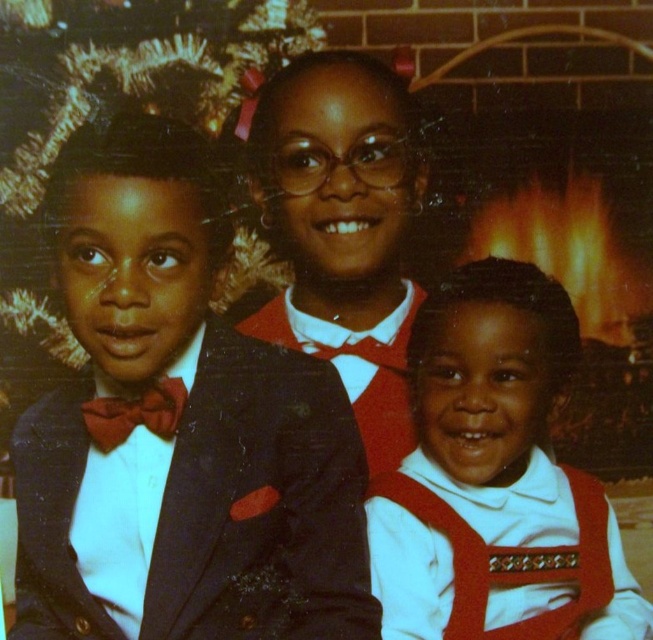
You are a photographer trying to capture a closeup of the matte red vest at lower right and the matte black vest at center. Which vest should you focus on first to ensure it appears larger in the photo?

The matte red vest at lower right is closer to the viewer than the matte black vest at center, so focusing on the matte red vest at lower right first will make it appear larger in the photo.

You are a tailor who needs to adjust the length of two vests. You have the matte red vest at lower right and the matte black vest at center. Which vest requires a hem adjustment to make it longer?

The matte red vest at lower right requires a hem adjustment to make it longer since it has a lesser height compared to the matte black vest at center.